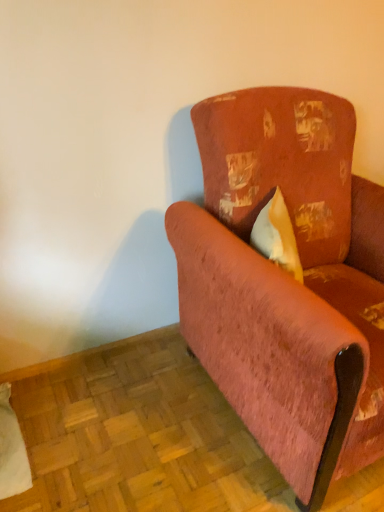
Locate an element on the screen. distressed red fabric couch at right is located at coordinates (288, 282).

The width and height of the screenshot is (384, 512). What do you see at coordinates (288, 282) in the screenshot?
I see `distressed red fabric couch at right` at bounding box center [288, 282].

Find the location of a particular element. Image resolution: width=384 pixels, height=512 pixels. distressed red fabric couch at right is located at coordinates (288, 282).